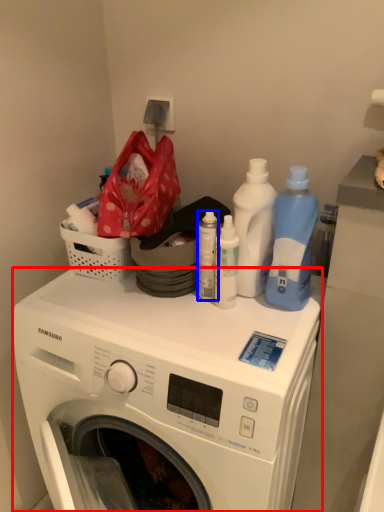
Question: Which object appears closest to the camera in this image, washing machine (highlighted by a red box) or bottle (highlighted by a blue box)?

Choices:
 (A) washing machine
 (B) bottle

Answer: (A)